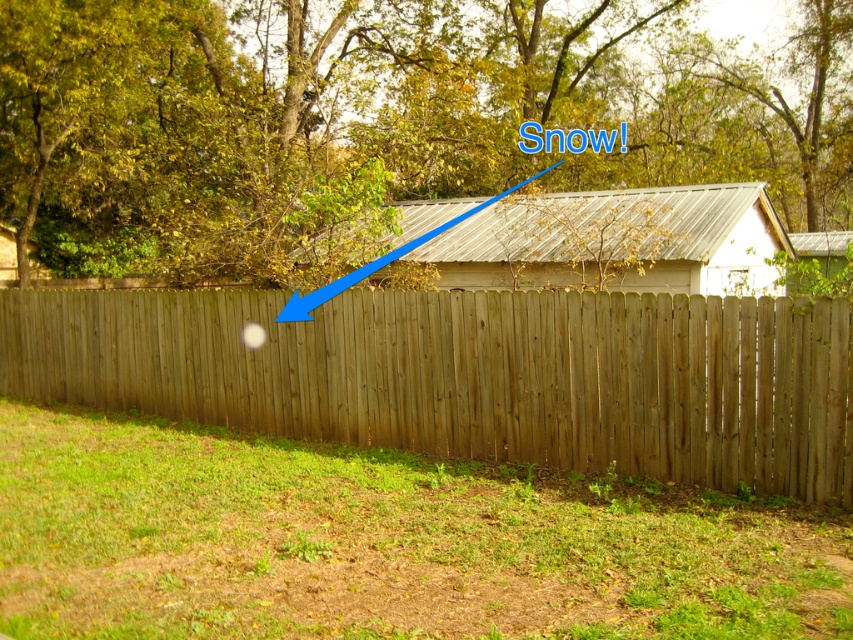
You are standing in the backyard and want to place a small garden ornament. You have two options for placement at point coordinates point (x=563, y=257) and point (x=549, y=166). Which point is closer to your current position?

Point (x=563, y=257) is closer to the camera than point (x=549, y=166), so placing the ornament at point (x=563, y=257) would be closer to your current position.

You are standing in the backyard and want to see the metallic gray hut at center. Which direction should you look relative to the wooden fence at center?

The metallic gray hut at center is above the wooden fence at center, so you should look upward from the wooden fence at center to see the metallic gray hut at center.